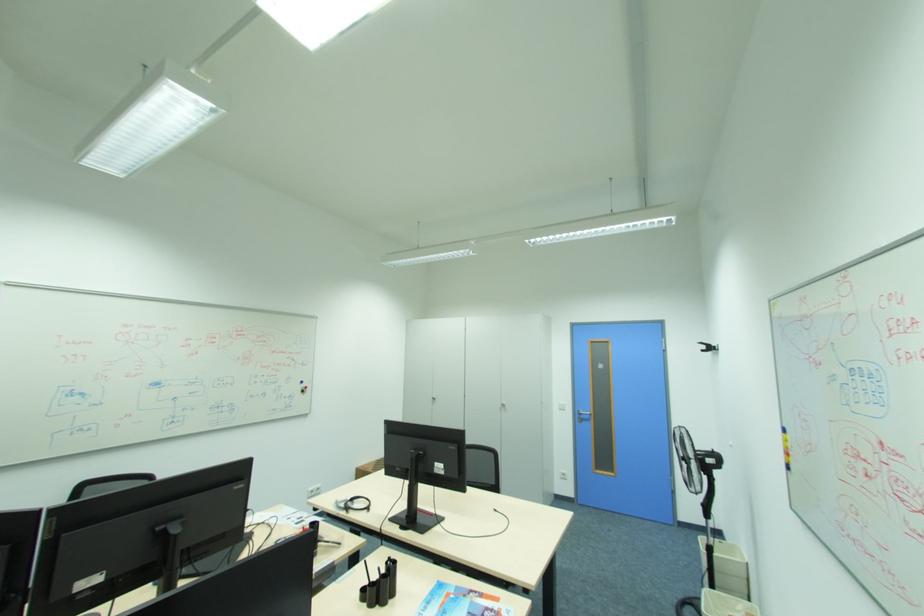
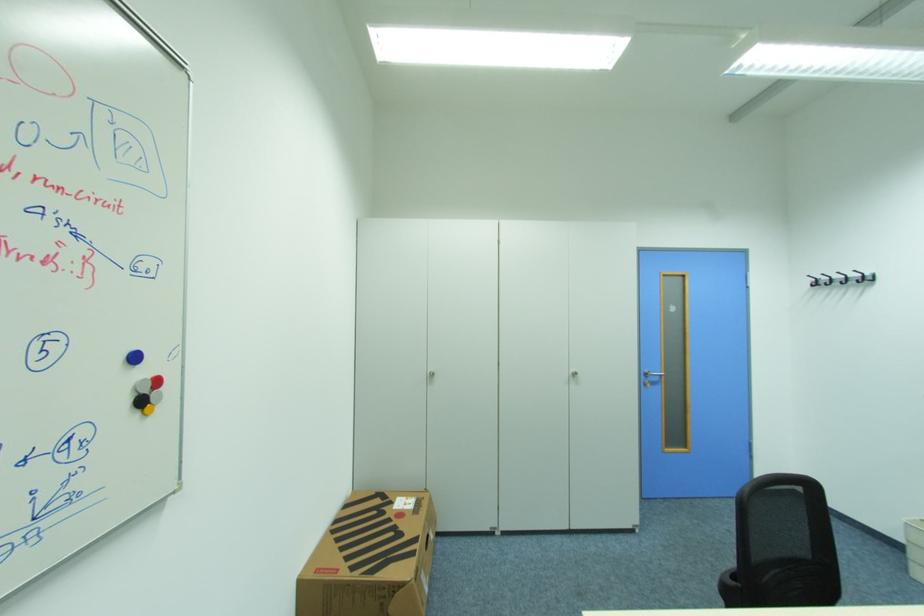
In the second image, find the point that corresponds to (309,391) in the first image.

(146, 403)